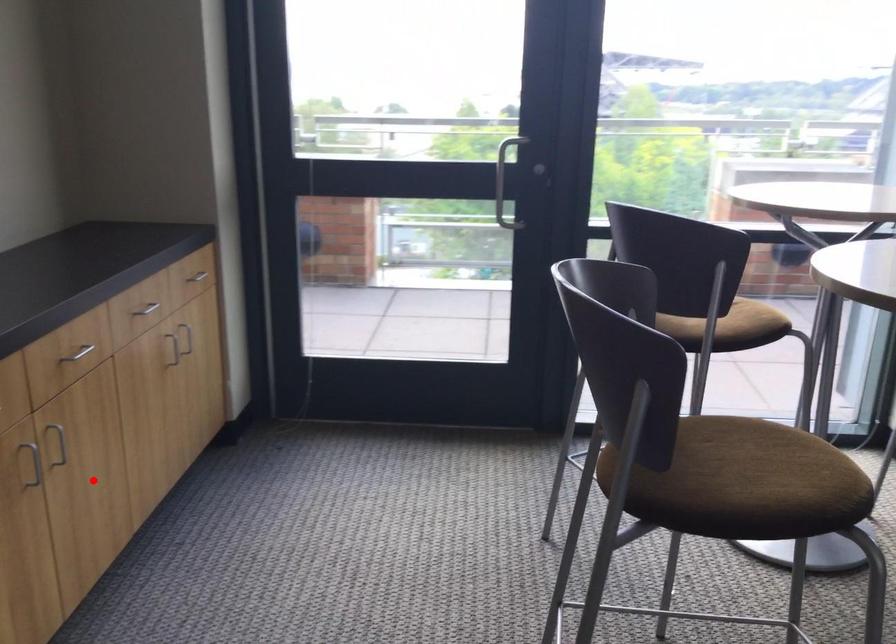
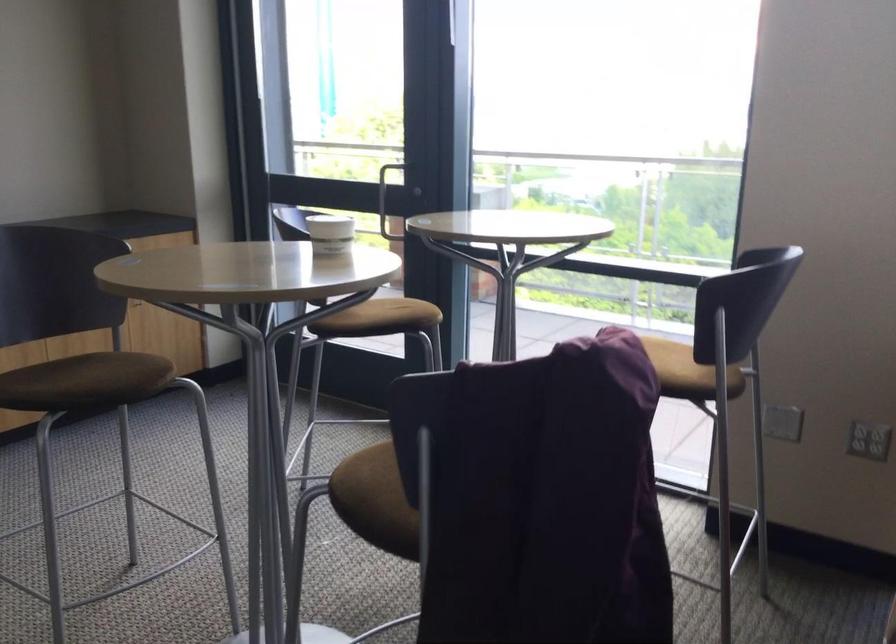
Question: A red point is marked in image1. In image2, is the corresponding 3D point closer to the camera or farther? Reply with the corresponding letter.

Choices:
 (A) The corresponding 3D point is closer.
 (B) The corresponding 3D point is farther.

Answer: (B)